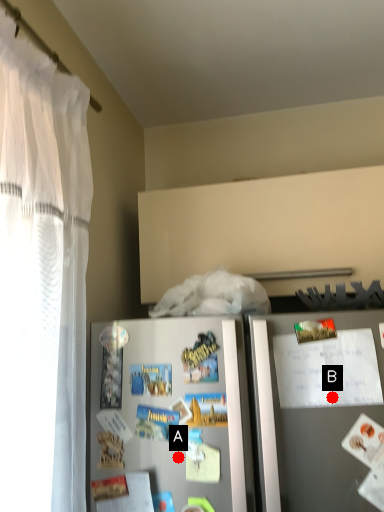
Question: Two points are circled on the image, labeled by A and B beside each circle. Which point appears closest to the camera in this image?

Choices:
 (A) A is closer
 (B) B is closer

Answer: (B)